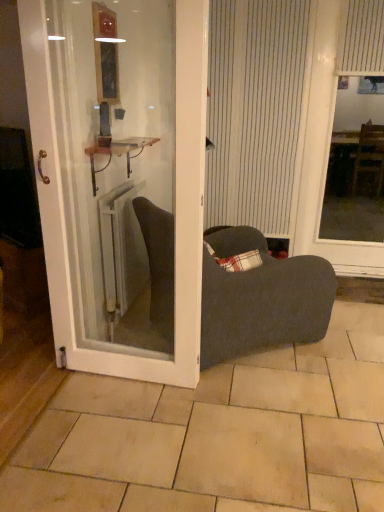
This screenshot has height=512, width=384. Find the location of `free space above beige tile at center (from a real-world perspective)`. free space above beige tile at center (from a real-world perspective) is located at coordinates (240, 413).